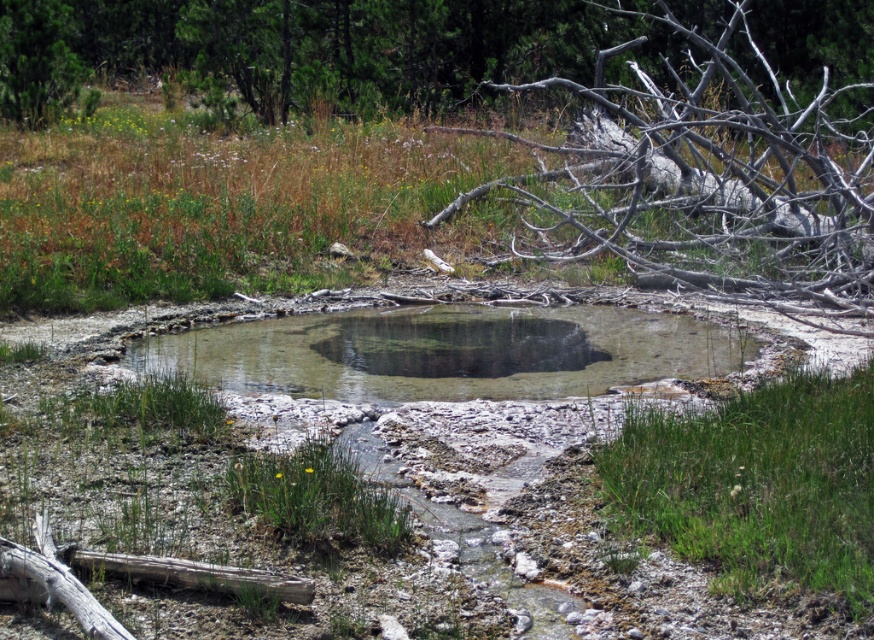
Looking at this image, who is positioned more to the left, clear water at center or green leafy tree at upper left?

green leafy tree at upper left is more to the left.

Does point (469, 372) come behind point (61, 4)?

That is False.

Where is `clear water at center`? The image size is (874, 640). clear water at center is located at coordinates (449, 353).

Between gray bark tree at upper right and clear water hole at center, which one appears on the left side from the viewer's perspective?

From the viewer's perspective, clear water hole at center appears more on the left side.

Between point (560, 224) and point (542, 356), which one is positioned behind?

Positioned behind is point (560, 224).

What are the coordinates of `gray bark tree at upper right` in the screenshot? It's located at (709, 172).

Which of these two, gray bark tree at upper right or clear water at center, stands shorter?

Standing shorter between the two is clear water at center.

Describe the element at coordinates (709, 172) in the screenshot. I see `gray bark tree at upper right` at that location.

Which is behind, point (800, 164) or point (460, 362)?

The point (800, 164) is behind.

Find the location of a particular element. This screenshot has width=874, height=640. gray bark tree at upper right is located at coordinates (709, 172).